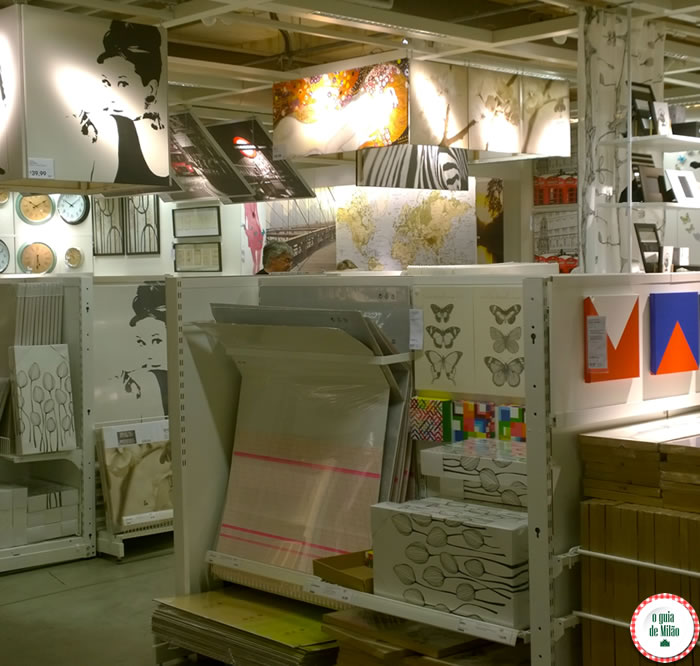
Locate an element on the screen. 2 of the same black and white painting of a woman is located at coordinates (104, 111), (143, 376).